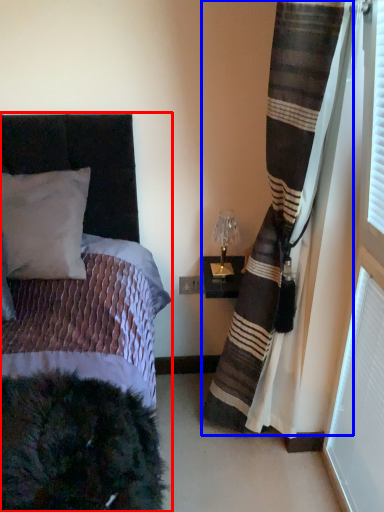
Question: Among these objects, which one is farthest to the camera, bed (highlighted by a red box) or curtain (highlighted by a blue box)?

Choices:
 (A) bed
 (B) curtain

Answer: (B)